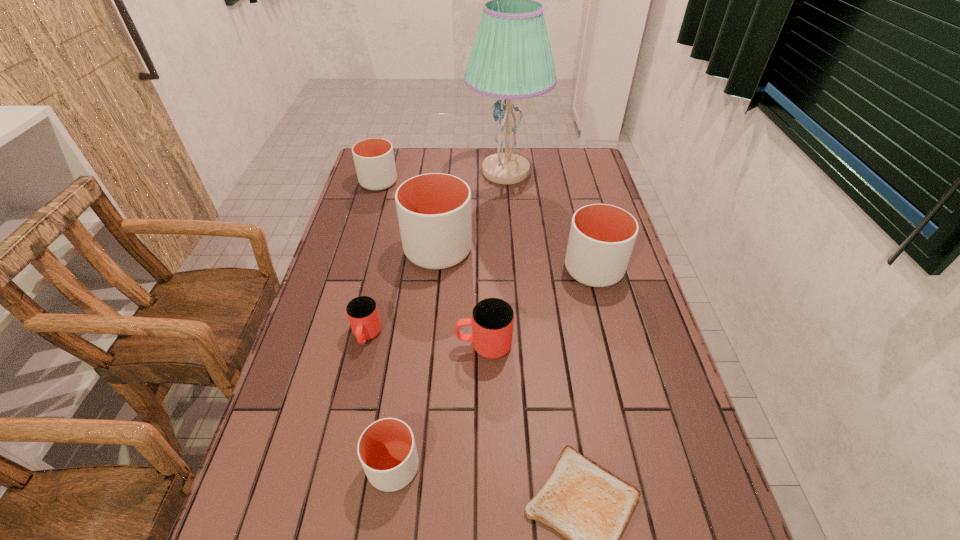
Where is `blank region between the second tallest cup and the farthest cup`? The image size is (960, 540). blank region between the second tallest cup and the farthest cup is located at coordinates (486, 226).

Where is `vacant space that is in between the tallest object and the nearest white cup`? The image size is (960, 540). vacant space that is in between the tallest object and the nearest white cup is located at coordinates (449, 319).

The image size is (960, 540). I want to click on empty space between the biggest white cup and the smallest white cup, so click(416, 359).

Locate an element on the screen. Image resolution: width=960 pixels, height=540 pixels. free space between the second biggest white cup and the biggest white cup is located at coordinates (516, 260).

Locate an element on the screen. The height and width of the screenshot is (540, 960). empty space that is in between the left pink cup and the biggest white cup is located at coordinates (402, 293).

Identify which object is located as the second nearest to the smallest white cup. Please provide its 2D coordinates. Your answer should be formatted as a tuple, i.e. [(x, y)], where the tuple contains the x and y coordinates of a point satisfying the conditions above.

[(492, 320)]

At what (x,y) coordinates should I click in order to perform the action: click on object that can be found as the fifth closest to the smaller pink cup. Please return your answer as a coordinate pair (x, y). Image resolution: width=960 pixels, height=540 pixels. Looking at the image, I should click on (602, 237).

Select which cup appears as the fifth closest to the second smallest white cup. Please provide its 2D coordinates. Your answer should be formatted as a tuple, i.e. [(x, y)], where the tuple contains the x and y coordinates of a point satisfying the conditions above.

[(386, 449)]

Identify which cup is the fourth nearest to the lamp. Please provide its 2D coordinates. Your answer should be formatted as a tuple, i.e. [(x, y)], where the tuple contains the x and y coordinates of a point satisfying the conditions above.

[(362, 312)]

Identify which white cup is located as the nearest to the nearest cup. Please provide its 2D coordinates. Your answer should be formatted as a tuple, i.e. [(x, y)], where the tuple contains the x and y coordinates of a point satisfying the conditions above.

[(434, 210)]